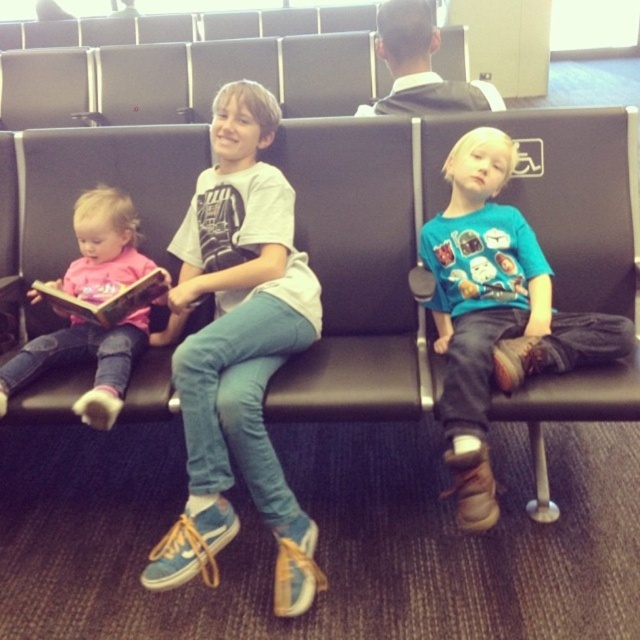
Does light blue denim jeans at center come behind smooth black shirt at center?

No, light blue denim jeans at center is in front of smooth black shirt at center.

Can you confirm if light blue denim jeans at center is positioned above smooth black shirt at center?

Incorrect, light blue denim jeans at center is not positioned above smooth black shirt at center.

The image size is (640, 640). Identify the location of light blue denim jeans at center. (237, 349).

Can you confirm if light blue denim jeans at center is thinner than pink fabric shirt at left?

Incorrect, light blue denim jeans at center's width is not less than pink fabric shirt at left's.

Which of these two, light blue denim jeans at center or pink fabric shirt at left, stands taller?

light blue denim jeans at center

I want to click on light blue denim jeans at center, so (x=237, y=349).

Where is `light blue denim jeans at center`? This screenshot has height=640, width=640. light blue denim jeans at center is located at coordinates (237, 349).

Who is positioned more to the left, smooth black shirt at center or hardcover book at left?

From the viewer's perspective, hardcover book at left appears more on the left side.

Is smooth black shirt at center to the left of hardcover book at left from the viewer's perspective?

In fact, smooth black shirt at center is to the right of hardcover book at left.

Find the location of a particular element. This screenshot has width=640, height=640. smooth black shirt at center is located at coordinates (416, 65).